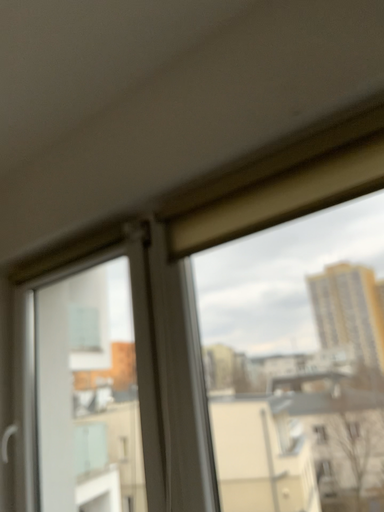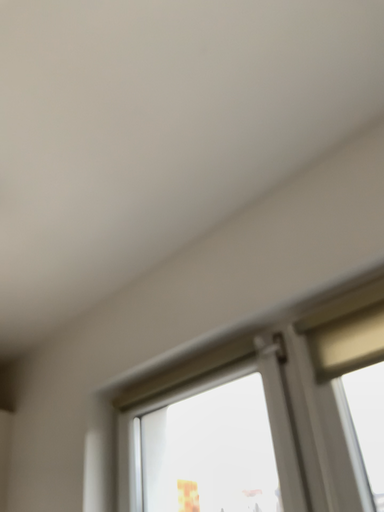
Question: Which way did the camera rotate in the video?

Choices:
 (A) rotated upward
 (B) rotated downward

Answer: (A)